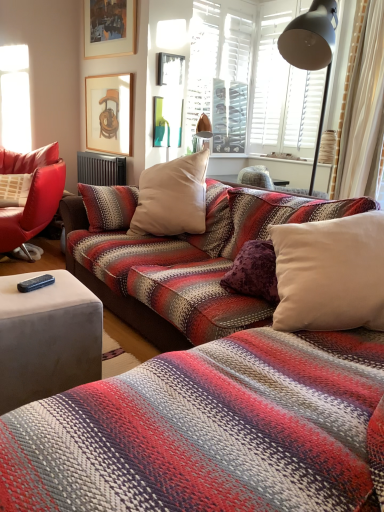
You are a GUI agent. You are given a task and a screenshot of the screen. Output one action in this format:
    pyautogui.click(x=<x>, y=<y>)
    Task: Click on the vacant space to the right of black rubber remote control at lower left
    The height and width of the screenshot is (512, 384).
    Given the screenshot: What is the action you would take?
    pyautogui.click(x=67, y=290)